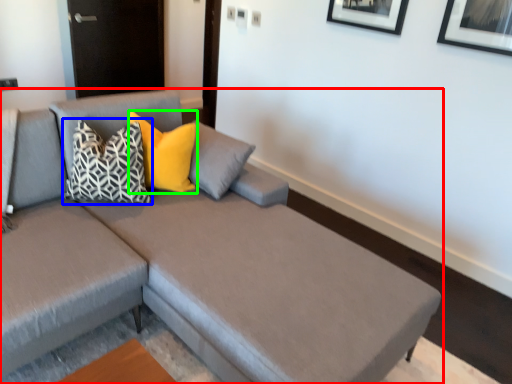
Question: Which object is the farthest from studio couch (highlighted by a red box)? Choose among these: pillow (highlighted by a blue box) or pillow (highlighted by a green box).

Choices:
 (A) pillow
 (B) pillow

Answer: (B)